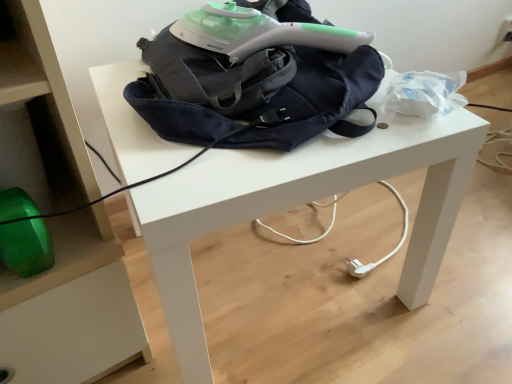
Question: Does denim backpack at center appear on the right side of white matte table at center?

Choices:
 (A) no
 (B) yes

Answer: (A)

Question: Could white matte table at center be considered to be inside denim backpack at center?

Choices:
 (A) no
 (B) yes

Answer: (A)

Question: Considering the relative sizes of denim backpack at center and white matte table at center in the image provided, is denim backpack at center shorter than white matte table at center?

Choices:
 (A) yes
 (B) no

Answer: (A)

Question: Is denim backpack at center oriented towards white matte table at center?

Choices:
 (A) yes
 (B) no

Answer: (B)

Question: Is white matte table at center at the back of denim backpack at center?

Choices:
 (A) no
 (B) yes

Answer: (A)

Question: Does denim backpack at center have a greater height compared to white matte table at center?

Choices:
 (A) yes
 (B) no

Answer: (B)

Question: Is white matte table at center completely or partially outside of denim backpack at center?

Choices:
 (A) yes
 (B) no

Answer: (A)

Question: Is white matte table at center in front of denim backpack at center?

Choices:
 (A) no
 (B) yes

Answer: (B)

Question: Considering the relative sizes of white matte table at center and denim backpack at center in the image provided, is white matte table at center shorter than denim backpack at center?

Choices:
 (A) no
 (B) yes

Answer: (A)

Question: Considering the relative positions of white matte table at center and denim backpack at center in the image provided, is white matte table at center to the right of denim backpack at center from the viewer's perspective?

Choices:
 (A) no
 (B) yes

Answer: (B)

Question: From the image's perspective, does white matte table at center appear lower than denim backpack at center?

Choices:
 (A) yes
 (B) no

Answer: (A)

Question: Is white matte table at center positioned far away from denim backpack at center?

Choices:
 (A) yes
 (B) no

Answer: (B)

Question: Looking at their shapes, would you say white matte table at center is wider or thinner than denim backpack at center?

Choices:
 (A) wide
 (B) thin

Answer: (A)